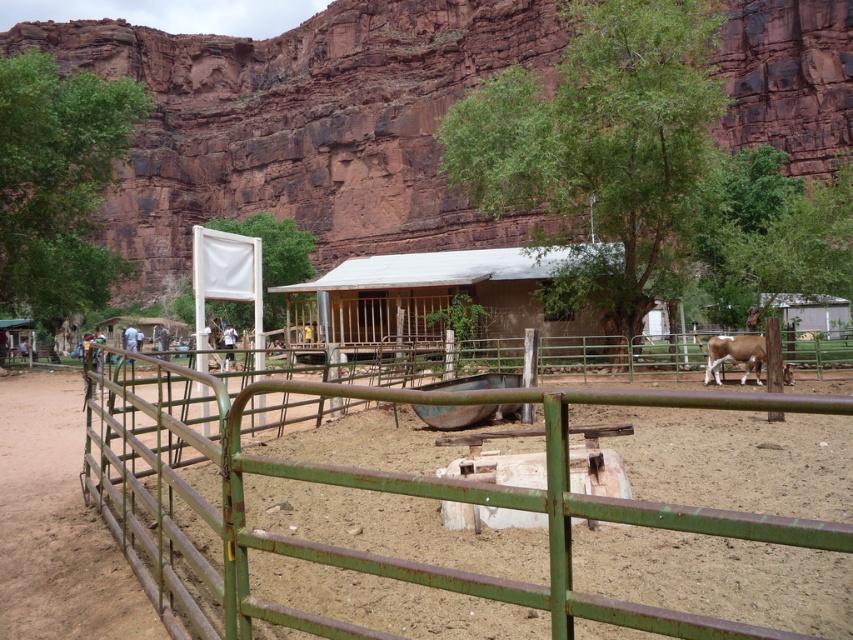
Question: Is brown wooden hut at center above brown speckled hide at right?

Choices:
 (A) no
 (B) yes

Answer: (B)

Question: Which is farther from the brown wooden hut at center?

Choices:
 (A) rusty metal fence at lower left
 (B) brown speckled hide at right

Answer: (A)

Question: Which point is farther from the camera taking this photo?

Choices:
 (A) (374, 300)
 (B) (709, 346)
 (C) (177, 515)

Answer: (A)

Question: Which of these objects is positioned farthest from the rusty metal fence at lower left?

Choices:
 (A) brown speckled hide at right
 (B) brown wooden hut at center

Answer: (B)

Question: Does rusty metal fence at lower left have a greater width compared to brown speckled hide at right?

Choices:
 (A) no
 (B) yes

Answer: (B)

Question: Is brown wooden hut at center above brown speckled hide at right?

Choices:
 (A) no
 (B) yes

Answer: (B)